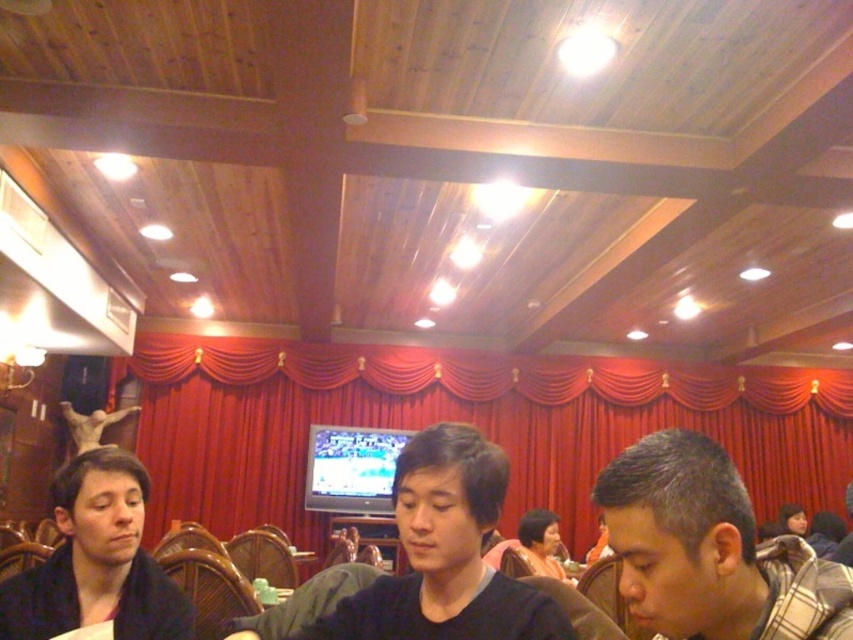
Question: Which is nearer to the black matte shirt at center?

Choices:
 (A) red velvet curtain at center
 (B) smooth black shirt at lower left
 (C) plaid fabric shirt at lower right

Answer: (C)

Question: Which object is farther from the camera taking this photo?

Choices:
 (A) black matte shirt at center
 (B) smooth black shirt at lower left
 (C) red velvet curtain at center

Answer: (C)

Question: Can you confirm if red velvet curtain at center is positioned below plaid fabric shirt at lower right?

Choices:
 (A) no
 (B) yes

Answer: (B)

Question: Does plaid fabric shirt at lower right have a lesser width compared to black matte shirt at center?

Choices:
 (A) no
 (B) yes

Answer: (B)

Question: Can you confirm if red velvet curtain at center is positioned above black matte shirt at center?

Choices:
 (A) yes
 (B) no

Answer: (B)

Question: Which of the following is the closest to the observer?

Choices:
 (A) (396, 634)
 (B) (676, 531)
 (C) (260, 352)
 (D) (100, 588)

Answer: (B)